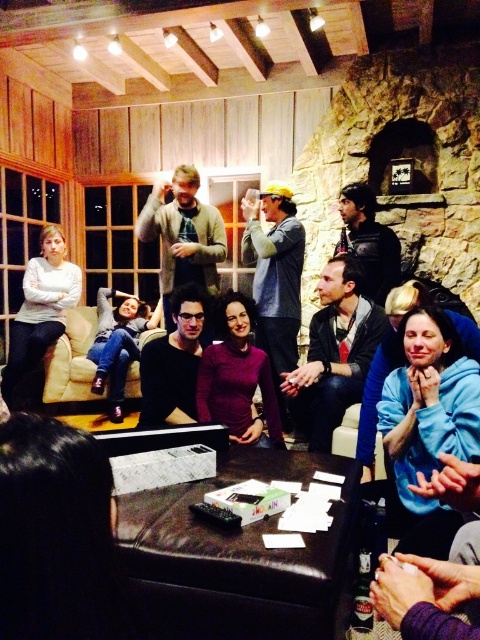
You are a guest at this gathering and notice two leather jackets in the room. One is the black leather jacket at center and the other is the leather jacket at upper center. Which one is taller?

The black leather jacket at center is much taller than the leather jacket at upper center.

You are a photographer trying to capture a candid shot of the group. You notice the black matte shirt at center and the leather jacket at upper center. Which clothing item would require a wider angle to fully capture in the frame?

The leather jacket at upper center requires a wider angle because it occupies more space than the black matte shirt at center.

You are a guest at this gathering and want to find the person wearing the black matte shirt at center. Where should you look relative to the person in the leather jacket at upper center?

The black matte shirt at center is located below the leather jacket at upper center, so you should look downward from the person wearing the leather jacket at upper center to find the one in the black matte shirt at center.